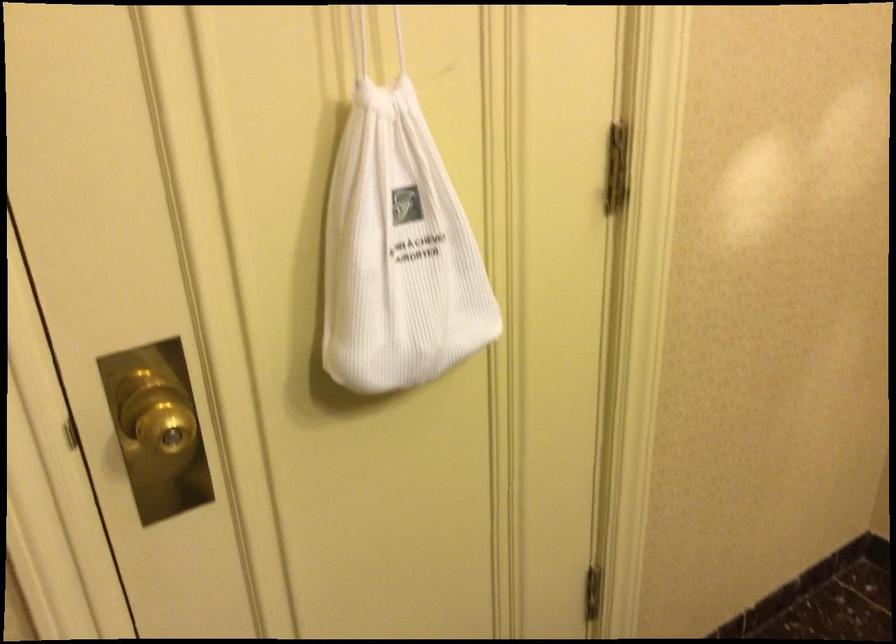
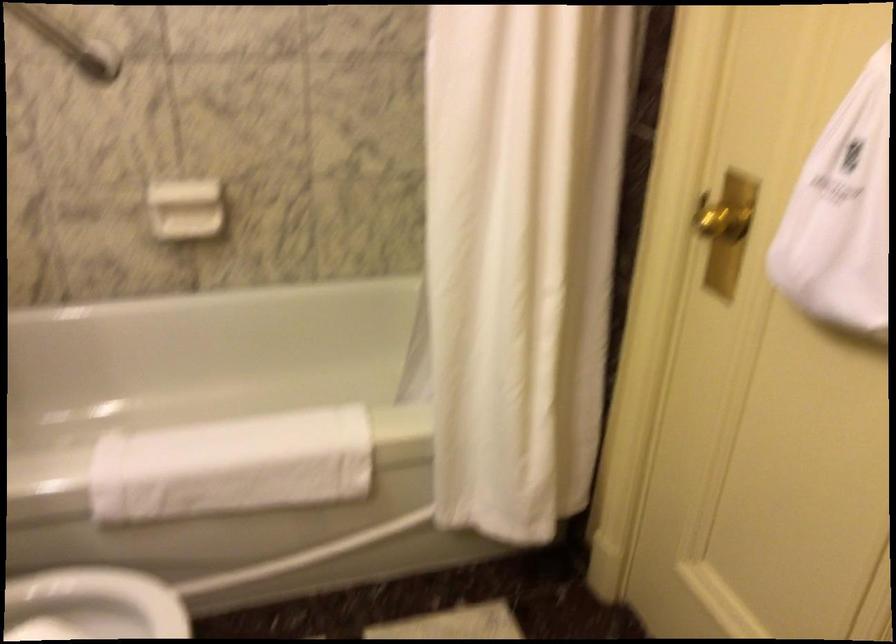
Find the pixel in the second image that matches point 400,292 in the first image.

(841, 214)